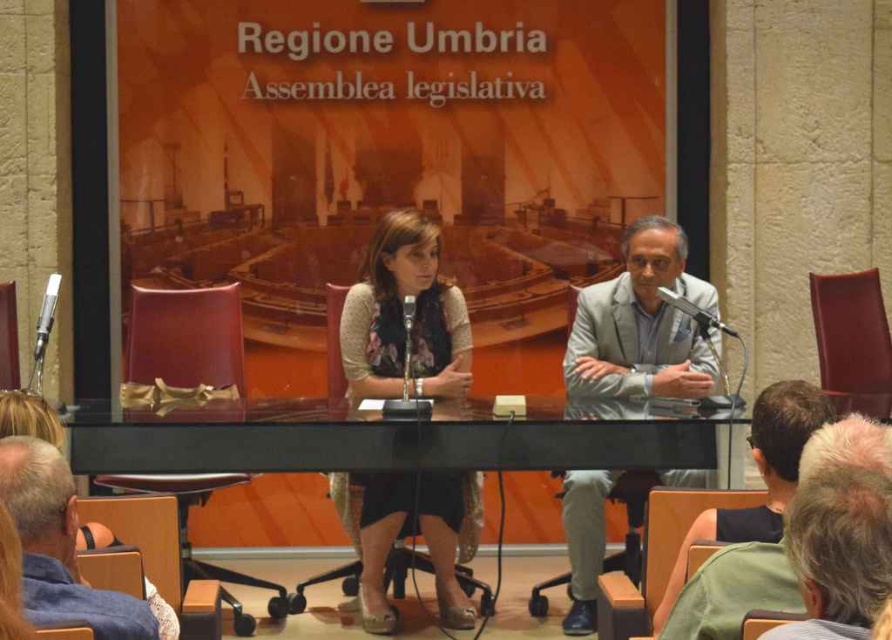
You are a guest speaker who needs to grab the metallic silver microphone at left from your current position at the black glass table at center. Can you reach it without moving your feet?

The distance between the black glass table at center and the metallic silver microphone at left is 3.61 feet. Since this distance is greater than an average person can reach without moving, you cannot reach the microphone without moving your feet.

You are an event organizer and need to adjust the seating arrangement. If you want to move the gray fabric chair at lower left closer to the black plastic microphone at center, which direction should you move it?

You should move the gray fabric chair at lower left to the right to bring it closer to the black plastic microphone at center since it is currently to the left of it.